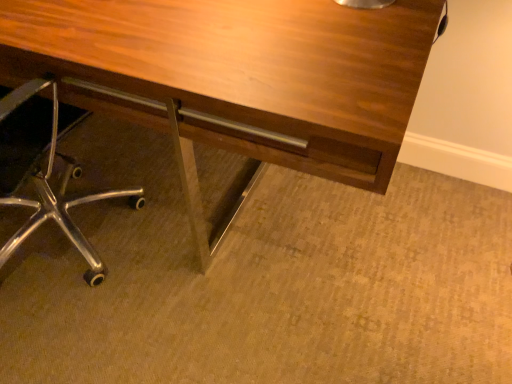
What are the coordinates of `metal/chrome chair at lower left` in the screenshot? It's located at (47, 172).

Describe the element at coordinates (47, 172) in the screenshot. I see `metal/chrome chair at lower left` at that location.

What do you see at coordinates (234, 77) in the screenshot? I see `wooden desk at center` at bounding box center [234, 77].

The height and width of the screenshot is (384, 512). I want to click on wooden desk at center, so click(234, 77).

Find the location of a particular element. This screenshot has height=384, width=512. metal/chrome chair at lower left is located at coordinates (47, 172).

Which is more to the left, wooden desk at center or metal/chrome chair at lower left?

From the viewer's perspective, metal/chrome chair at lower left appears more on the left side.

Relative to metal/chrome chair at lower left, is wooden desk at center in front or behind?

In the image, wooden desk at center appears behind metal/chrome chair at lower left.

Which is less distant, (367, 152) or (36, 212)?

The point (367, 152) is in front.

Based on the photo, from the image's perspective, who appears lower, wooden desk at center or metal/chrome chair at lower left?

metal/chrome chair at lower left appears lower in the image.

From a real-world perspective, which is physically below, wooden desk at center or metal/chrome chair at lower left?

wooden desk at center, from a real-world perspective.

Which object is thinner, wooden desk at center or metal/chrome chair at lower left?

metal/chrome chair at lower left is thinner.

Who is taller, wooden desk at center or metal/chrome chair at lower left?

metal/chrome chair at lower left.

Considering the relative sizes of wooden desk at center and metal/chrome chair at lower left in the image provided, is wooden desk at center bigger than metal/chrome chair at lower left?

Yes, wooden desk at center is bigger than metal/chrome chair at lower left.

Is metal/chrome chair at lower left a part of wooden desk at center?

Yes, metal/chrome chair at lower left can be found within wooden desk at center.

Is wooden desk at center directly adjacent to metal/chrome chair at lower left?

No, wooden desk at center is not making contact with metal/chrome chair at lower left.

Is wooden desk at center facing towards metal/chrome chair at lower left?

Yes, wooden desk at center is facing metal/chrome chair at lower left.

Measure the distance from wooden desk at center to metal/chrome chair at lower left.

18.37 inches.

I want to click on chair above the wooden desk at center (from a real-world perspective), so click(x=47, y=172).

Which is more to the right, metal/chrome chair at lower left or wooden desk at center?

wooden desk at center is more to the right.

Does metal/chrome chair at lower left lie behind wooden desk at center?

No, metal/chrome chair at lower left is in front of wooden desk at center.

Considering the points (94, 262) and (196, 120), which point is behind, point (94, 262) or point (196, 120)?

Point (94, 262)

From the image's perspective, which one is positioned higher, metal/chrome chair at lower left or wooden desk at center?

wooden desk at center is shown above in the image.

From a real-world perspective, is metal/chrome chair at lower left located beneath wooden desk at center?

Incorrect, from a real-world perspective, metal/chrome chair at lower left is higher than wooden desk at center.

Consider the image. Considering the relative sizes of metal/chrome chair at lower left and wooden desk at center in the image provided, is metal/chrome chair at lower left thinner than wooden desk at center?

Correct, the width of metal/chrome chair at lower left is less than that of wooden desk at center.

From their relative heights in the image, would you say metal/chrome chair at lower left is taller or shorter than wooden desk at center?

Considering their sizes, metal/chrome chair at lower left has more height than wooden desk at center.

Considering the sizes of objects metal/chrome chair at lower left and wooden desk at center in the image provided, who is smaller, metal/chrome chair at lower left or wooden desk at center?

metal/chrome chair at lower left is smaller.

Would you say metal/chrome chair at lower left is inside or outside wooden desk at center?

metal/chrome chair at lower left is contained in wooden desk at center.

Is metal/chrome chair at lower left positioned far away from wooden desk at center?

No, metal/chrome chair at lower left is not far from wooden desk at center.

Is metal/chrome chair at lower left turned away from wooden desk at center?

No.

How many degrees apart are the facing directions of metal/chrome chair at lower left and wooden desk at center?

179 degrees separate the facing orientations of metal/chrome chair at lower left and wooden desk at center.

Identify the location of desk behind the metal/chrome chair at lower left. The width and height of the screenshot is (512, 384). (234, 77).

Locate an element on the screen. The height and width of the screenshot is (384, 512). desk on the right of metal/chrome chair at lower left is located at coordinates (234, 77).

Identify the location of chair lying on the left of wooden desk at center. tap(47, 172).